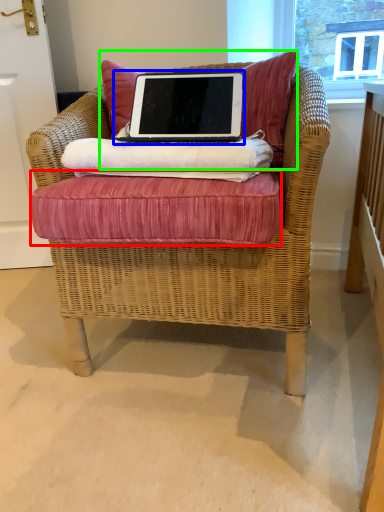
Question: Which object is positioned farthest from bed frame (highlighted by a red box)? Select from laptop (highlighted by a blue box) and pillow (highlighted by a green box).

Choices:
 (A) laptop
 (B) pillow

Answer: (B)